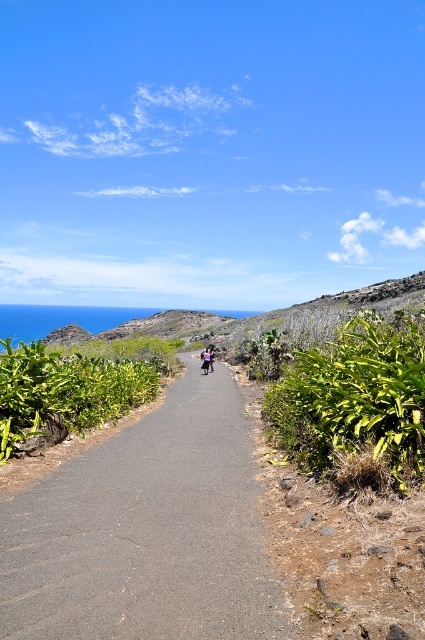
You are a hiker standing at the starting point of the coastal path and want to reach the end of the path. There are two points marked on your map labeled as point (125, 566) and point (365, 476). Which point should you head towards first to stay on the correct path?

You should head towards point (125, 566) first because it is in front of point (365, 476) along the path.